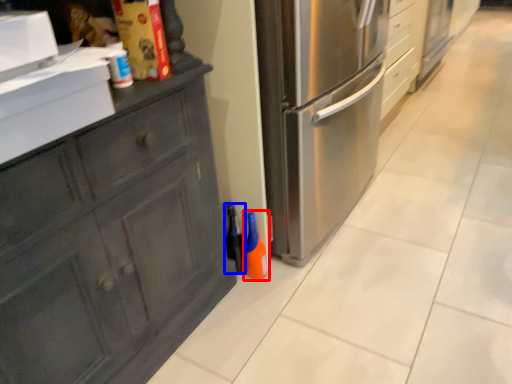
Question: Which point is further to the camera, bottle (highlighted by a red box) or bottle (highlighted by a blue box)?

Choices:
 (A) bottle
 (B) bottle

Answer: (B)